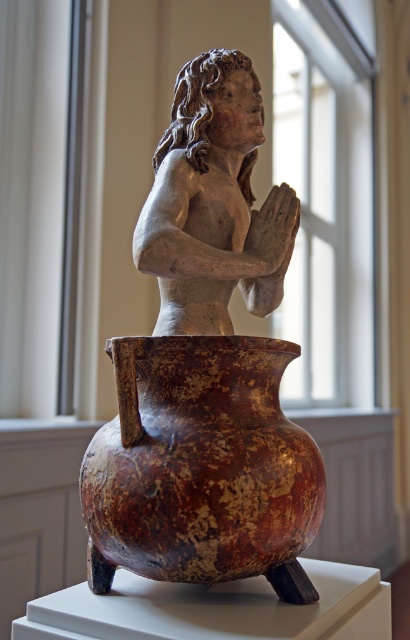
The image size is (410, 640). In order to click on rusty ceramic vase at center in this screenshot , I will do `click(202, 467)`.

Does rusty ceramic vase at center have a smaller size compared to matte gray statue at center?

Correct, rusty ceramic vase at center occupies less space than matte gray statue at center.

Image resolution: width=410 pixels, height=640 pixels. Find the location of `rusty ceramic vase at center`. rusty ceramic vase at center is located at coordinates (202, 467).

I want to click on rusty ceramic vase at center, so click(202, 467).

Does matte clay figure at center appear on the right side of rusty ceramic vase at center?

Indeed, matte clay figure at center is positioned on the right side of rusty ceramic vase at center.

Is matte clay figure at center smaller than rusty ceramic vase at center?

Incorrect, matte clay figure at center is not smaller in size than rusty ceramic vase at center.

Between point (198, 157) and point (173, 480), which one is positioned in front?

Point (173, 480)

The width and height of the screenshot is (410, 640). What are the coordinates of `matte clay figure at center` in the screenshot? It's located at (205, 368).

Who is positioned more to the right, matte clay figure at center or matte gray statue at center?

matte gray statue at center is more to the right.

Can you confirm if matte clay figure at center is positioned above matte gray statue at center?

No, matte clay figure at center is not above matte gray statue at center.

Who is more forward, (184,241) or (159,204)?

Point (184,241) is more forward.

The width and height of the screenshot is (410, 640). I want to click on matte clay figure at center, so click(x=205, y=368).